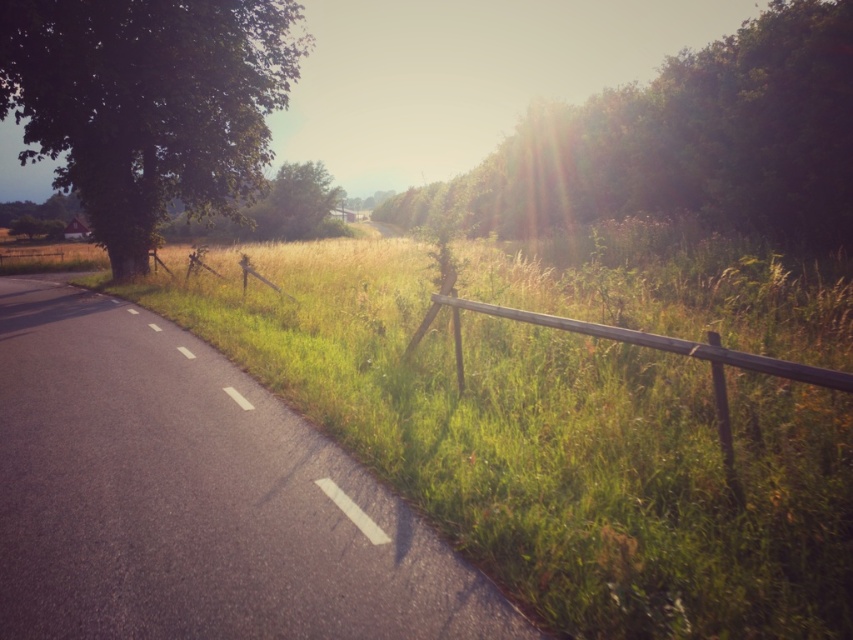
Question: Which is nearer to the wooden fence at right?

Choices:
 (A) green leafy tree at left
 (B) green grass at center
 (C) green leafy tree at upper right

Answer: (B)

Question: Among these points, which one is farthest from the camera?

Choices:
 (A) (479, 301)
 (B) (836, 42)
 (C) (817, 545)
 (D) (113, 172)

Answer: (D)

Question: Is green grass at center smaller than wooden fence at right?

Choices:
 (A) yes
 (B) no

Answer: (B)

Question: Is green leafy tree at upper right above wooden fence at right?

Choices:
 (A) yes
 (B) no

Answer: (A)

Question: Does green leafy tree at left appear over wooden fence at right?

Choices:
 (A) no
 (B) yes

Answer: (B)

Question: Estimate the real-world distances between objects in this image. Which object is farther from the green leafy tree at left?

Choices:
 (A) wooden fence at right
 (B) green leafy tree at upper right

Answer: (B)